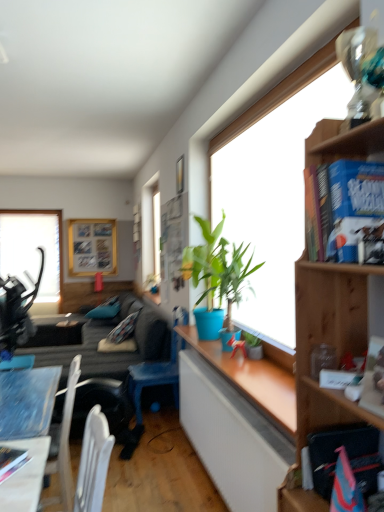
Question: From a real-world perspective, relative to wooden bookshelf at upper right, is dark gray fabric couch at lower left vertically above or below?

Choices:
 (A) above
 (B) below

Answer: (B)

Question: Visually, is dark gray fabric couch at lower left positioned to the left or to the right of wooden bookshelf at upper right?

Choices:
 (A) left
 (B) right

Answer: (A)

Question: Based on their relative distances, which object is farther from the hardcover book at lower left, the 3th book viewed from the top?

Choices:
 (A) wooden picture frame at upper left
 (B) transparent glass window at upper left
 (C) blue plastic chair at lower center
 (D) blue hardcover book at upper right, the first book when ordered from top to bottom
 (E) wooden desk at lower left

Answer: (A)

Question: Based on their relative distances, which object is nearer to the hardcover book at lower left, marked as the 1th book in a bottom-to-top arrangement?

Choices:
 (A) hardcover book at center-right, marked as the second book in a front-to-back arrangement
 (B) wooden desk at lower left
 (C) transparent glass window at upper left
 (D) wooden picture frame at upper left
 (E) blue hardcover book at upper right, the first book when ordered from top to bottom

Answer: (B)